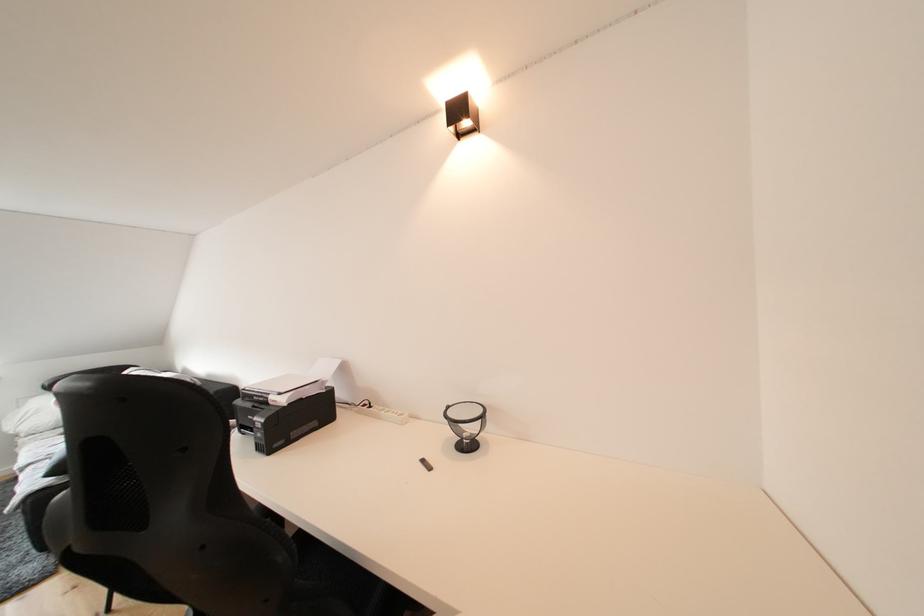
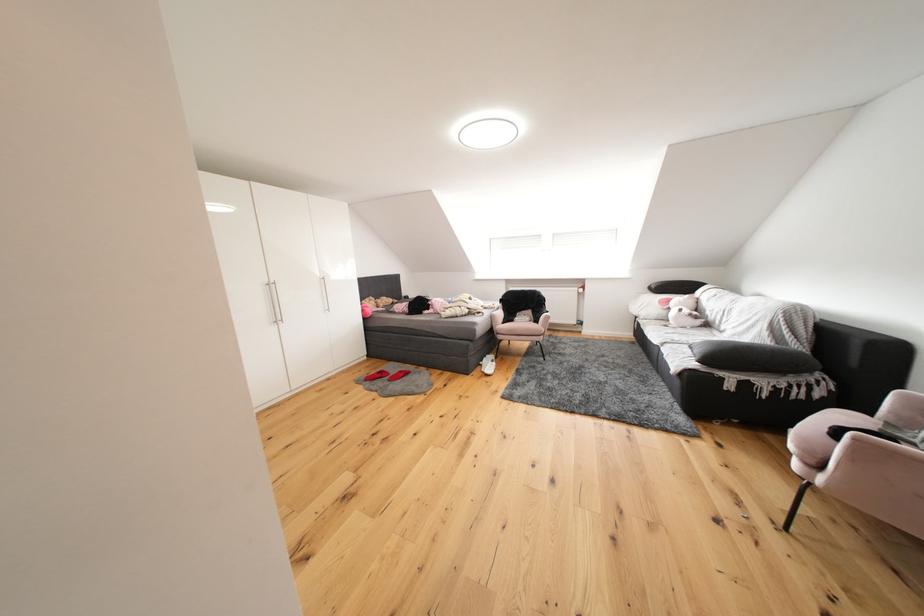
Where in the second image is the point corresponding to pixel 51 432 from the first image?

(660, 321)